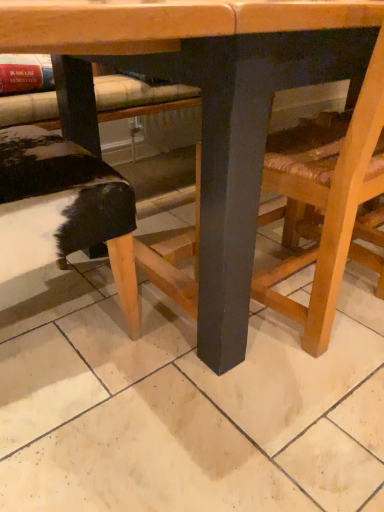
Question: Does wooden chair at lower right turn towards black furry cushion at lower left?

Choices:
 (A) no
 (B) yes

Answer: (A)

Question: Does wooden chair at lower right have a lesser width compared to black furry cushion at lower left?

Choices:
 (A) no
 (B) yes

Answer: (A)

Question: Is wooden chair at lower right smaller than black furry cushion at lower left?

Choices:
 (A) yes
 (B) no

Answer: (B)

Question: Can you confirm if wooden chair at lower right is shorter than black furry cushion at lower left?

Choices:
 (A) yes
 (B) no

Answer: (B)

Question: From the image's perspective, does wooden chair at lower right appear higher than black furry cushion at lower left?

Choices:
 (A) yes
 (B) no

Answer: (A)

Question: Is wooden table at center to the left or to the right of black furry cushion at lower left in the image?

Choices:
 (A) left
 (B) right

Answer: (B)

Question: Is point (223, 74) positioned closer to the camera than point (26, 136)?

Choices:
 (A) closer
 (B) farther

Answer: (A)

Question: In terms of width, does wooden table at center look wider or thinner when compared to black furry cushion at lower left?

Choices:
 (A) wide
 (B) thin

Answer: (A)

Question: Which is correct: wooden table at center is inside black furry cushion at lower left, or outside of it?

Choices:
 (A) outside
 (B) inside

Answer: (A)

Question: Is point (327, 292) positioned closer to the camera than point (107, 232)?

Choices:
 (A) farther
 (B) closer

Answer: (A)

Question: Considering the relative positions of wooden chair at lower right and black furry cushion at lower left in the image provided, is wooden chair at lower right to the left or to the right of black furry cushion at lower left?

Choices:
 (A) right
 (B) left

Answer: (A)

Question: From the image's perspective, relative to black furry cushion at lower left, is wooden chair at lower right above or below?

Choices:
 (A) below
 (B) above

Answer: (B)

Question: In terms of size, does wooden chair at lower right appear bigger or smaller than black furry cushion at lower left?

Choices:
 (A) big
 (B) small

Answer: (A)

Question: Is wooden chair at lower right situated inside wooden table at center or outside?

Choices:
 (A) inside
 (B) outside

Answer: (A)

Question: From their relative heights in the image, would you say wooden chair at lower right is taller or shorter than wooden table at center?

Choices:
 (A) tall
 (B) short

Answer: (B)